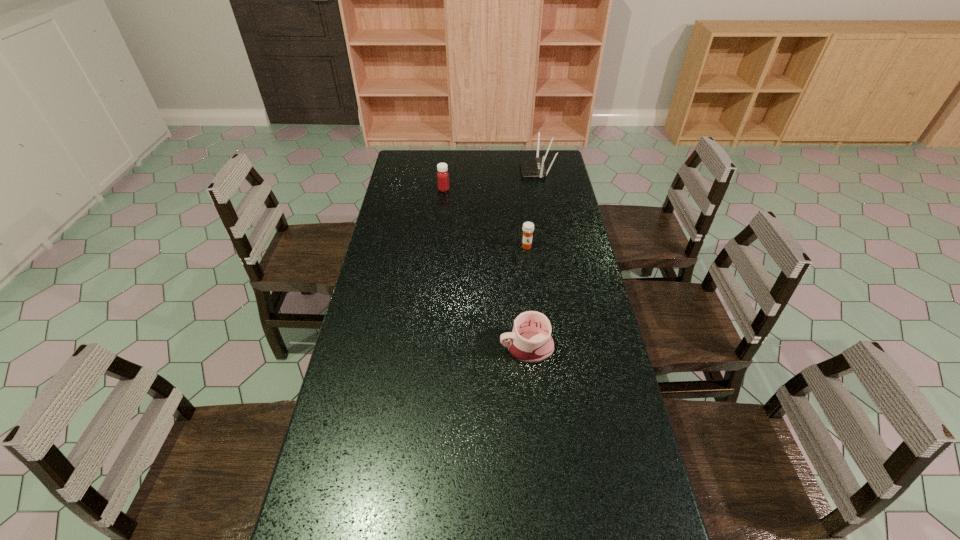
Identify the location of free spot located on the label side of the right medicine. Image resolution: width=960 pixels, height=540 pixels. (531, 281).

I want to click on free space located on the side with the handle of the mug, so click(x=476, y=347).

Locate an element on the screen. The width and height of the screenshot is (960, 540). free space located on the side with the handle of the mug is located at coordinates (443, 347).

What are the coordinates of `vacant space situated 0.180m on the side with the handle of the mug` in the screenshot? It's located at (439, 347).

Find the location of `object at the far edge`. object at the far edge is located at coordinates (530, 167).

I want to click on object present at the right edge, so click(x=530, y=167).

This screenshot has height=540, width=960. Identify the location of object positioned at the far right corner. (530, 167).

I want to click on free location at the far edge, so click(x=462, y=170).

This screenshot has height=540, width=960. Identify the location of free space at the left edge of the desktop. (373, 412).

Image resolution: width=960 pixels, height=540 pixels. I want to click on vacant space at the right edge of the desktop, so click(552, 303).